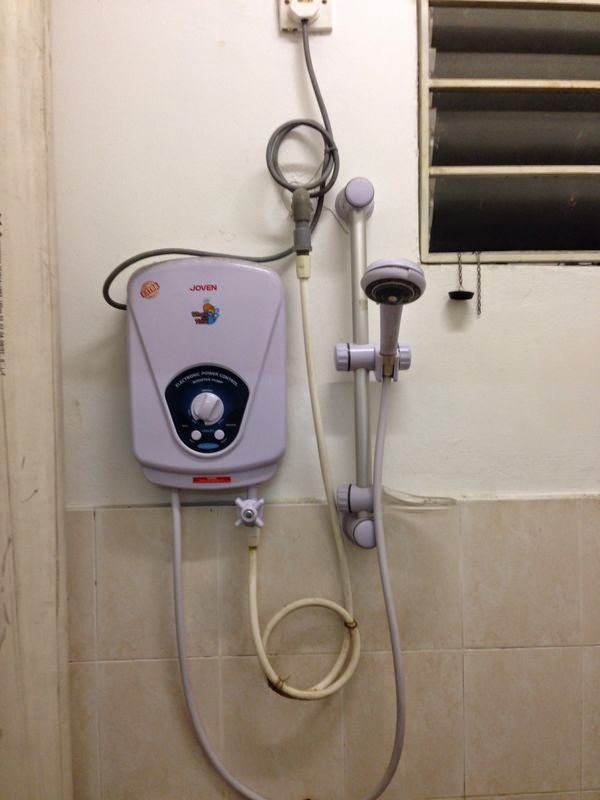
Where is `white rounded rectangular device on the wall`? Image resolution: width=600 pixels, height=800 pixels. white rounded rectangular device on the wall is located at coordinates (215, 350).